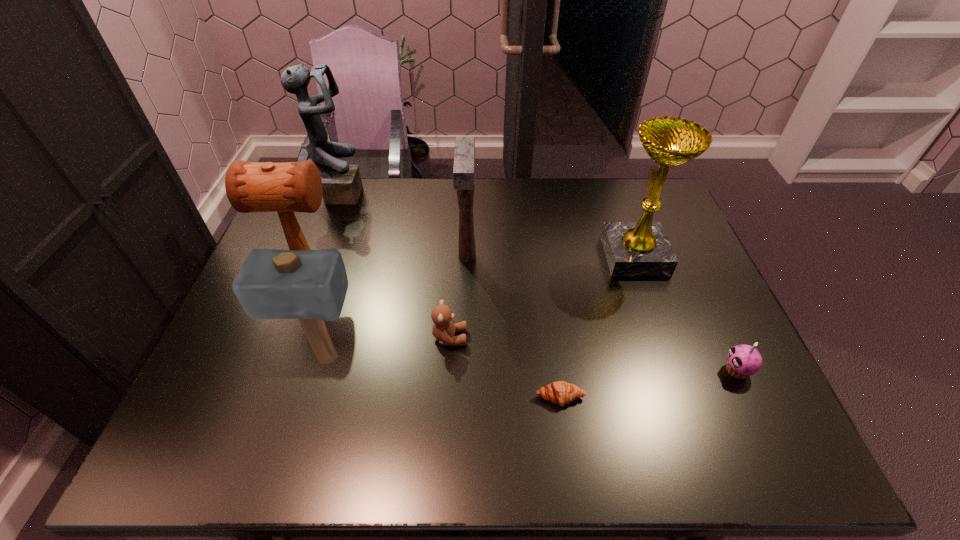
Identify the location of vacant space that's between the teddy bear and the award. (542, 296).

Where is `vacant space that's between the sculpture and the cupcake`? This screenshot has width=960, height=540. vacant space that's between the sculpture and the cupcake is located at coordinates (539, 281).

At what (x,y) coordinates should I click in order to perform the action: click on vacant area between the nearest mallet and the teddy bear. Please return your answer as a coordinate pair (x, y). This screenshot has height=540, width=960. Looking at the image, I should click on pyautogui.click(x=388, y=348).

Where is `vacant space that's between the farthest object and the rightmost object`? vacant space that's between the farthest object and the rightmost object is located at coordinates (539, 281).

Where is `blank region between the sculpture and the shortest object`? The image size is (960, 540). blank region between the sculpture and the shortest object is located at coordinates pos(450,295).

This screenshot has height=540, width=960. I want to click on vacant area that lies between the cupcake and the teddy bear, so click(x=593, y=354).

Where is `object identified as the fourth closest to the sixth object from left to right`? The height and width of the screenshot is (540, 960). object identified as the fourth closest to the sixth object from left to right is located at coordinates (642, 248).

This screenshot has width=960, height=540. I want to click on object that can be found as the second closest to the award, so click(560, 392).

Identify which mallet is located as the nearest to the teddy bear. Please provide its 2D coordinates. Your answer should be formatted as a tuple, i.e. [(x, y)], where the tuple contains the x and y coordinates of a point satisfying the conditions above.

[(310, 285)]

Point out which mallet is positioned as the nearest to the nearest mallet. Please provide its 2D coordinates. Your answer should be formatted as a tuple, i.e. [(x, y)], where the tuple contains the x and y coordinates of a point satisfying the conditions above.

[(285, 188)]